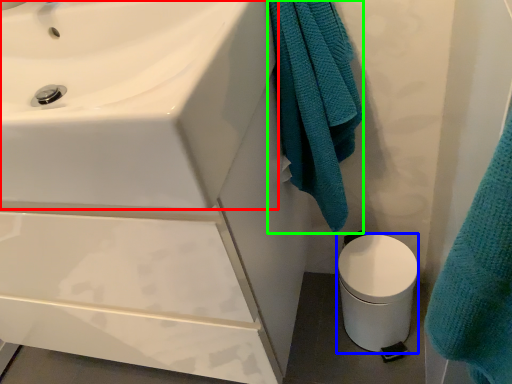
Question: Which object is the closest to the sink (highlighted by a red box)? Choose among these: toilet bowl (highlighted by a blue box) or bath towel (highlighted by a green box).

Choices:
 (A) toilet bowl
 (B) bath towel

Answer: (B)